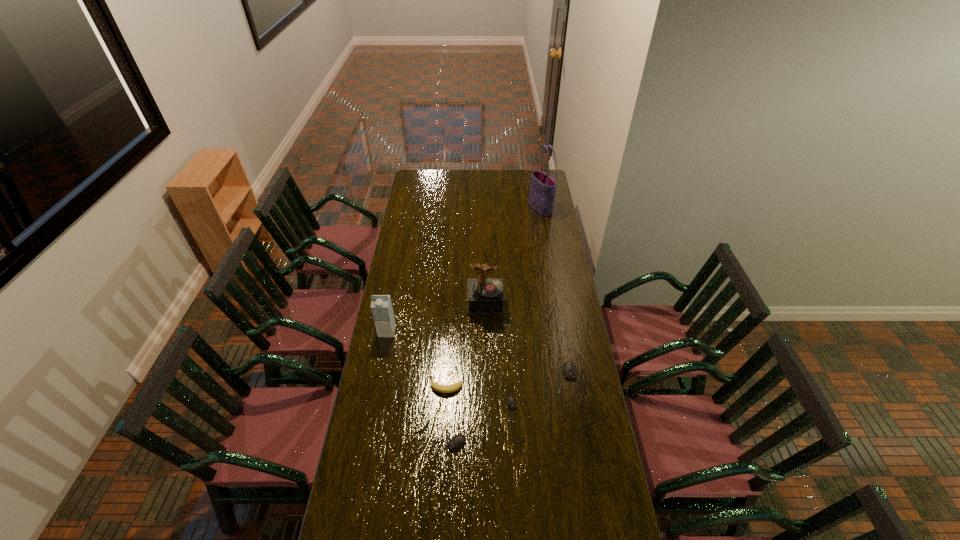
Please point a spot to add another mouse on the left. Please provide its 2D coordinates. Your answer should be formatted as a tuple, i.e. [(x, y)], where the tuple contains the x and y coordinates of a point satisfying the conditions above.

[(376, 485)]